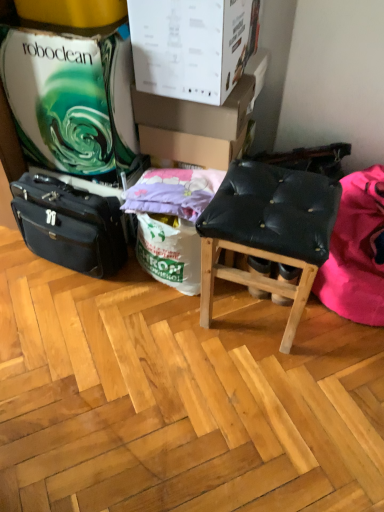
Question: Considering the positions of black leather stool at center and pink fabric at right in the image, is black leather stool at center wider or thinner than pink fabric at right?

Choices:
 (A) thin
 (B) wide

Answer: (A)

Question: From the image's perspective, is black leather stool at center above or below pink fabric at right?

Choices:
 (A) below
 (B) above

Answer: (A)

Question: Which object is positioned farthest from the white cardboard box at upper center, placed as the 1th cardboard box when sorted from front to back?

Choices:
 (A) pink fabric at right
 (B) purple cotton pillow at center
 (C) black leather stool at center
 (D) black leather briefcase at left
 (E) cardboard box at upper center, acting as the second cardboard box starting from the front

Answer: (A)

Question: Which object is the farthest from the white cardboard box at upper center, placed as the third cardboard box when sorted from back to front?

Choices:
 (A) cardboard box at upper center, which is the third cardboard box in front-to-back order
 (B) black leather briefcase at left
 (C) cardboard box at upper center, acting as the second cardboard box starting from the front
 (D) purple cotton pillow at center
 (E) black leather stool at center

Answer: (B)